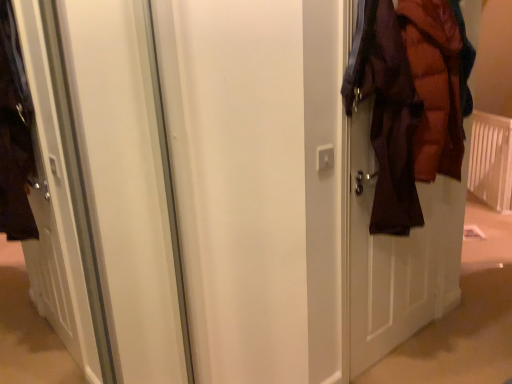
Question: Considering the positions of white plastic radiator at right and brown puffy jacket at right in the image, is white plastic radiator at right wider or thinner than brown puffy jacket at right?

Choices:
 (A) thin
 (B) wide

Answer: (A)

Question: Is white plastic radiator at right spatially inside brown puffy jacket at right, or outside of it?

Choices:
 (A) inside
 (B) outside

Answer: (B)

Question: Is point 506,185 positioned closer to the camera than point 460,49?

Choices:
 (A) closer
 (B) farther

Answer: (B)

Question: Considering the relative positions of brown puffy jacket at right and white plastic radiator at right in the image provided, is brown puffy jacket at right to the left or to the right of white plastic radiator at right?

Choices:
 (A) right
 (B) left

Answer: (B)

Question: Is brown puffy jacket at right bigger or smaller than white plastic radiator at right?

Choices:
 (A) big
 (B) small

Answer: (B)

Question: From the image's perspective, is brown puffy jacket at right positioned above or below white plastic radiator at right?

Choices:
 (A) below
 (B) above

Answer: (A)

Question: Relative to white plastic radiator at right, is brown puffy jacket at right in front or behind?

Choices:
 (A) behind
 (B) front

Answer: (B)